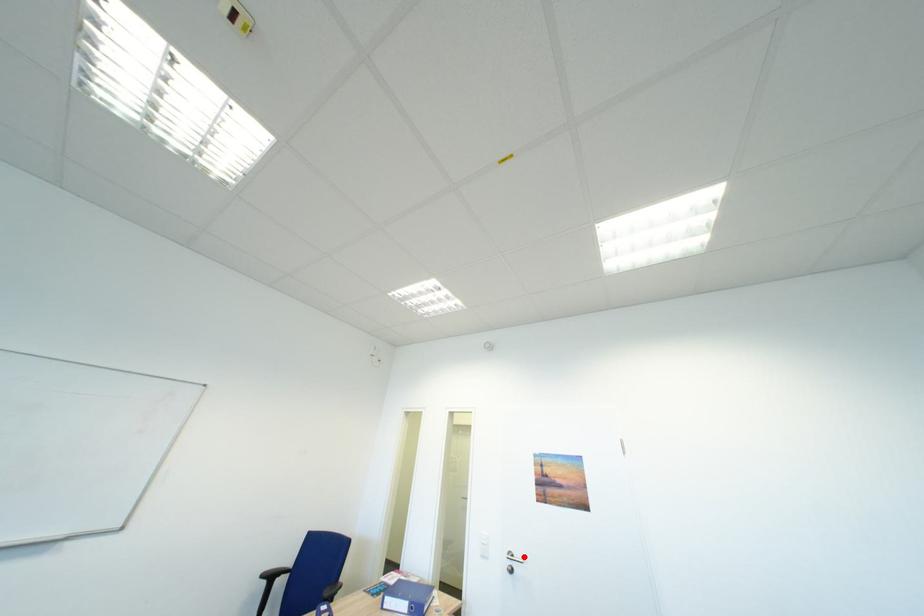
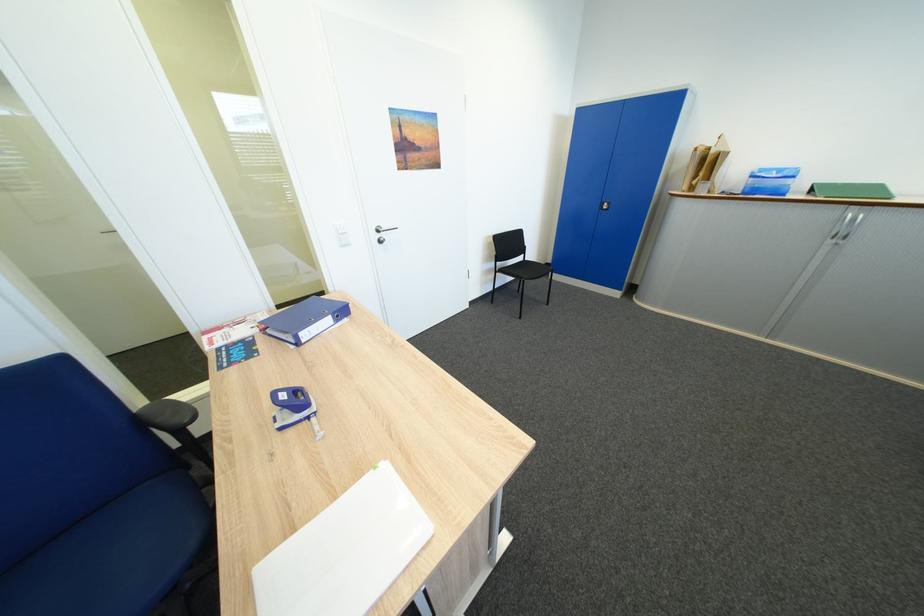
Locate, in the second image, the point that corresponds to the highlighted location in the first image.

(392, 229)